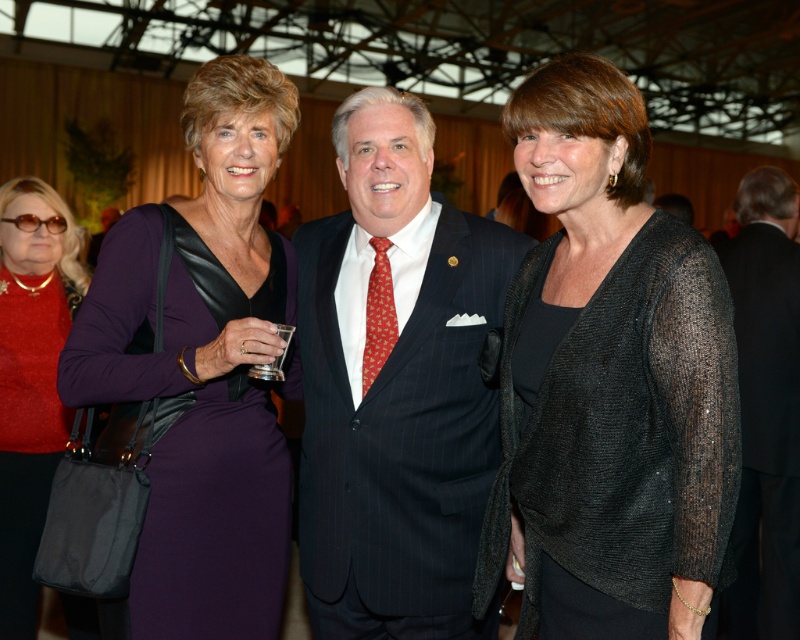
Between point (450, 413) and point (249, 161), which one is positioned behind?

The point (249, 161) is more distant.

Can you confirm if pinstriped suit at center is bigger than purple satin dress at center?

No, pinstriped suit at center is not bigger than purple satin dress at center.

Does point (446, 348) come behind point (248, 280)?

That is False.

The width and height of the screenshot is (800, 640). I want to click on pinstriped suit at center, so click(x=396, y=387).

Does black sheer cardigan at center appear on the left side of red silk tie at center?

Incorrect, black sheer cardigan at center is not on the left side of red silk tie at center.

Find the location of a particular element. black sheer cardigan at center is located at coordinates (609, 381).

Does black sheer cardigan at center have a lesser height compared to purple satin dress at center?

Yes.

Consider the image. Is black sheer cardigan at center positioned before purple satin dress at center?

Yes.

Does point (609, 461) come behind point (244, 492)?

No, (609, 461) is closer to viewer.

The height and width of the screenshot is (640, 800). I want to click on black sheer cardigan at center, so click(x=609, y=381).